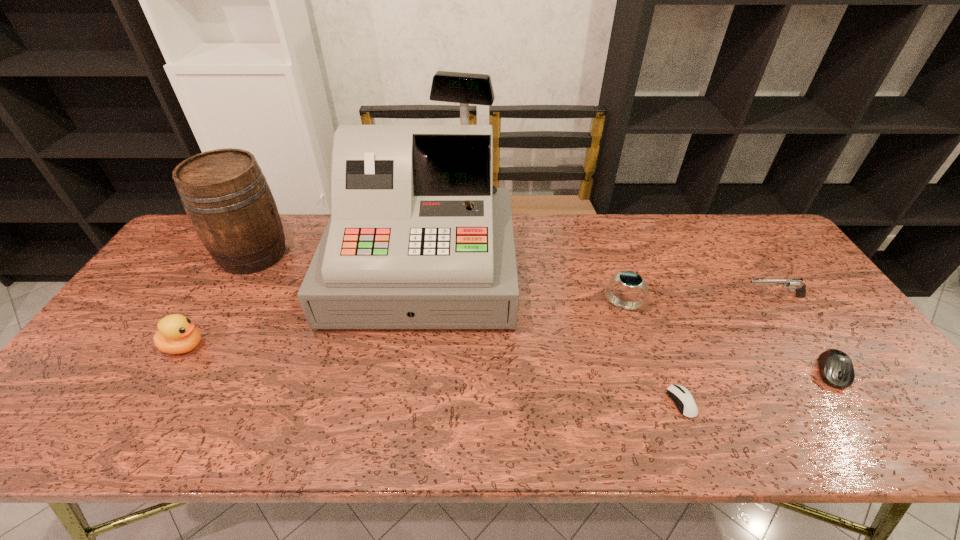
I want to click on the fourth closest object to the right mouse, so click(x=419, y=237).

In order to click on vacant space that satisfies the following two spatial constraints: 1. on the front-facing side of the sixth tallest object; 2. on the right side of the third shortest object in this screenshot , I will do `click(825, 373)`.

Where is `vacant position in the image that satisfies the following two spatial constraints: 1. on the keypad side of the fifth object from right to left; 2. on the face of the duckling`? vacant position in the image that satisfies the following two spatial constraints: 1. on the keypad side of the fifth object from right to left; 2. on the face of the duckling is located at coordinates (412, 347).

This screenshot has width=960, height=540. Find the location of `vacant position in the image that satisfies the following two spatial constraints: 1. on the side of the watch near the bung hole; 2. on the left side of the sixth shortest object`. vacant position in the image that satisfies the following two spatial constraints: 1. on the side of the watch near the bung hole; 2. on the left side of the sixth shortest object is located at coordinates (225, 305).